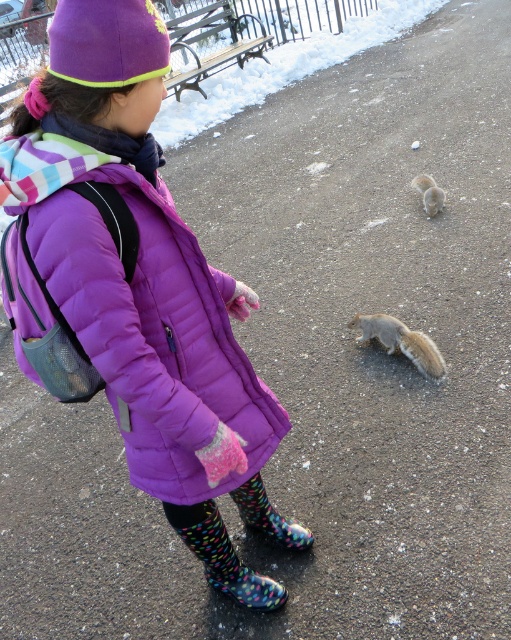
Based on the photo, you are a photographer trying to capture both squirrels in a single shot. Given that your camera can only focus on objects within a 1.2 meter range from the lens, and the gray furry squirrel at center is 1.5 meters away from you, will the fuzzy gray squirrel at lower center also be within the camera focus range?

The gray furry squirrel at center is 1.5 meters away from you, which is beyond the camera focus range of 1.2 meters. Therefore, neither squirrel will be in focus. However, if the gray furry squirrel at center is closer than the fuzzy gray squirrel at lower center, the fuzzy gray squirrel at lower center would be even further away, making it even less likely to be in focus. But according to the object descriptions, the gray furry squirrel at center is bigger than the fuzzy gray squirrel at lower center, so,